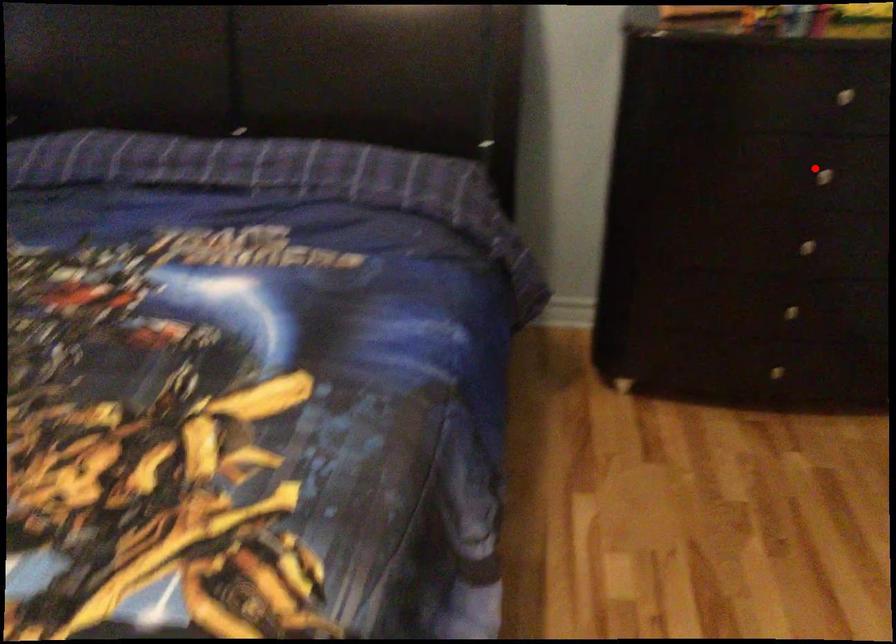
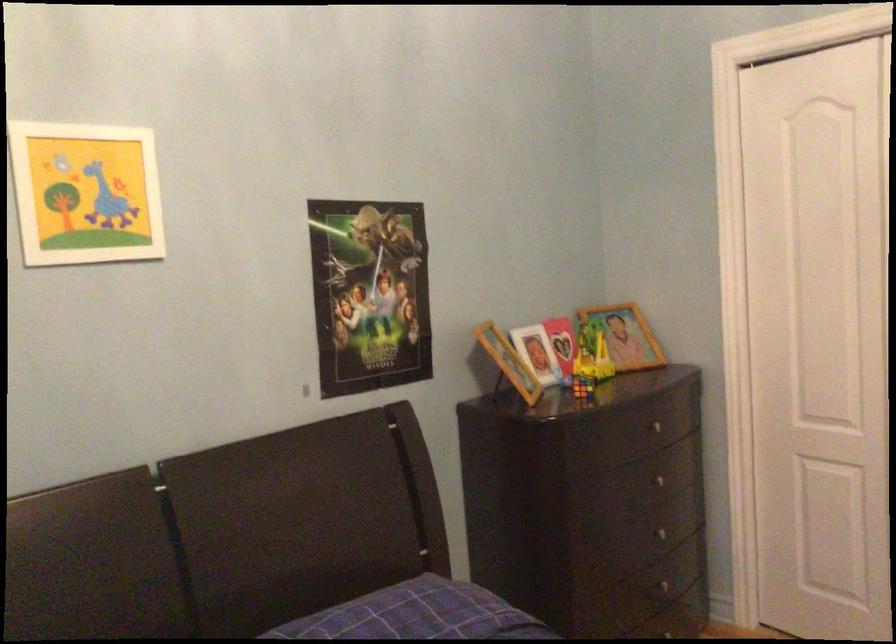
The point at the highlighted location is marked in the first image. Where is the corresponding point in the second image?

(656, 480)